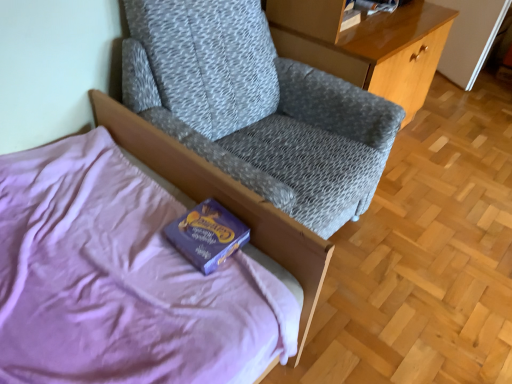
The height and width of the screenshot is (384, 512). I want to click on textured gray fabric chair at upper center, so pyautogui.click(x=257, y=108).

What do you see at coordinates (224, 201) in the screenshot? This screenshot has width=512, height=384. I see `purple soft bed at lower left` at bounding box center [224, 201].

Measure the distance between point (168,168) and camera.

Point (168,168) is 4.24 feet from camera.

What are the coordinates of `textured gray fabric chair at upper center` in the screenshot? It's located at (257, 108).

Can you tell me how much textured gray fabric chair at upper center and wooden glossy desk at upper right differ in facing direction?

2.06 degrees.

Looking at their sizes, would you say textured gray fabric chair at upper center is wider or thinner than wooden glossy desk at upper right?

In the image, textured gray fabric chair at upper center appears to be wider than wooden glossy desk at upper right.

Would you consider textured gray fabric chair at upper center to be distant from wooden glossy desk at upper right?

No.

Based on their sizes in the image, would you say textured gray fabric chair at upper center is bigger or smaller than wooden glossy desk at upper right?

In the image, textured gray fabric chair at upper center appears to be larger than wooden glossy desk at upper right.

Can you confirm if textured gray fabric chair at upper center is positioned to the left of purple soft bed at lower left?

Yes.

Which of these two, textured gray fabric chair at upper center or purple soft bed at lower left, is thinner?

With smaller width is textured gray fabric chair at upper center.

Which object is more forward, textured gray fabric chair at upper center or purple soft bed at lower left?

Positioned in front is purple soft bed at lower left.

Is textured gray fabric chair at upper center aimed at purple soft bed at lower left?

No, textured gray fabric chair at upper center is not oriented towards purple soft bed at lower left.

Considering the relative sizes of wooden glossy desk at upper right and purple soft bed at lower left in the image provided, is wooden glossy desk at upper right bigger than purple soft bed at lower left?

Yes.

From the picture: Measure the distance from wooden glossy desk at upper right to purple soft bed at lower left.

wooden glossy desk at upper right and purple soft bed at lower left are 1.04 meters apart.

Is wooden glossy desk at upper right not within purple soft bed at lower left?

That's correct, wooden glossy desk at upper right is outside of purple soft bed at lower left.

How far apart are purple matte paperback book at lower left and wooden glossy desk at upper right?

The distance of purple matte paperback book at lower left from wooden glossy desk at upper right is 1.13 meters.

Considering the sizes of purple matte paperback book at lower left and wooden glossy desk at upper right in the image, is purple matte paperback book at lower left bigger or smaller than wooden glossy desk at upper right?

In the image, purple matte paperback book at lower left appears to be smaller than wooden glossy desk at upper right.

Which of these two, purple matte paperback book at lower left or wooden glossy desk at upper right, stands shorter?

With less height is purple matte paperback book at lower left.

How many degrees apart are the facing directions of purple soft bed at lower left and purple matte paperback book at lower left?

The facing directions of purple soft bed at lower left and purple matte paperback book at lower left are 179 degrees apart.

Does purple soft bed at lower left touch purple matte paperback book at lower left?

They are not placed beside each other.

From the image's perspective, would you say purple soft bed at lower left is positioned over purple matte paperback book at lower left?

Yes, from the image's perspective, purple soft bed at lower left is above purple matte paperback book at lower left.

Where is `paperback book behind the purple soft bed at lower left`? The height and width of the screenshot is (384, 512). paperback book behind the purple soft bed at lower left is located at coordinates (207, 235).

In the scene shown: Measure the distance from wooden glossy desk at upper right to textured gray fabric chair at upper center.

wooden glossy desk at upper right is 16.84 inches from textured gray fabric chair at upper center.

Considering the points (394, 81) and (335, 120), which point is behind, point (394, 81) or point (335, 120)?

The point (394, 81) is more distant.

Between wooden glossy desk at upper right and textured gray fabric chair at upper center, which one has smaller size?

With smaller size is wooden glossy desk at upper right.

In the image, is wooden glossy desk at upper right positioned in front of or behind purple matte paperback book at lower left?

wooden glossy desk at upper right is positioned farther from the viewer than purple matte paperback book at lower left.

Measure the distance between wooden glossy desk at upper right and purple matte paperback book at lower left.

A distance of 3.69 feet exists between wooden glossy desk at upper right and purple matte paperback book at lower left.

From a real-world perspective, which object stands above the other?

wooden glossy desk at upper right, from a real-world perspective.

Could you tell me if wooden glossy desk at upper right is facing purple matte paperback book at lower left?

No, wooden glossy desk at upper right is not oriented towards purple matte paperback book at lower left.

Locate an element on the screen. chair in front of the wooden glossy desk at upper right is located at coordinates (257, 108).

The height and width of the screenshot is (384, 512). In order to click on chair behind the purple soft bed at lower left in this screenshot , I will do `click(257, 108)`.

Considering their positions, is textured gray fabric chair at upper center positioned further to purple soft bed at lower left than wooden glossy desk at upper right?

The object further to purple soft bed at lower left is wooden glossy desk at upper right.

Which object lies nearer to the anchor point textured gray fabric chair at upper center, purple matte paperback book at lower left or purple soft bed at lower left?

purple soft bed at lower left is closer to textured gray fabric chair at upper center.

Looking at the image, which one is located further to purple soft bed at lower left, textured gray fabric chair at upper center or purple matte paperback book at lower left?

textured gray fabric chair at upper center is positioned further to the anchor purple soft bed at lower left.

Estimate the real-world distances between objects in this image. Which object is further from wooden glossy desk at upper right, purple soft bed at lower left or textured gray fabric chair at upper center?

purple soft bed at lower left.

Looking at the image, which one is located further to wooden glossy desk at upper right, textured gray fabric chair at upper center or purple matte paperback book at lower left?

purple matte paperback book at lower left lies further to wooden glossy desk at upper right than the other object.

From the image, which object appears to be nearer to wooden glossy desk at upper right, purple soft bed at lower left or purple matte paperback book at lower left?

The object closer to wooden glossy desk at upper right is purple soft bed at lower left.

Based on their spatial positions, is purple matte paperback book at lower left or textured gray fabric chair at upper center further from wooden glossy desk at upper right?

purple matte paperback book at lower left lies further to wooden glossy desk at upper right than the other object.

From the image, which object appears to be farther from purple soft bed at lower left, purple matte paperback book at lower left or wooden glossy desk at upper right?

Among the two, wooden glossy desk at upper right is located further to purple soft bed at lower left.

This screenshot has width=512, height=384. Find the location of `chair that lies between wooden glossy desk at upper right and purple matte paperback book at lower left from top to bottom`. chair that lies between wooden glossy desk at upper right and purple matte paperback book at lower left from top to bottom is located at coordinates (257, 108).

Where is `desk located between purple matte paperback book at lower left and purple soft bed at lower left in the left-right direction`? The width and height of the screenshot is (512, 384). desk located between purple matte paperback book at lower left and purple soft bed at lower left in the left-right direction is located at coordinates (366, 45).

I want to click on desk situated between textured gray fabric chair at upper center and purple soft bed at lower left from left to right, so click(366, 45).

Where is `chair located between purple matte paperback book at lower left and purple soft bed at lower left in the left-right direction`? This screenshot has height=384, width=512. chair located between purple matte paperback book at lower left and purple soft bed at lower left in the left-right direction is located at coordinates (257, 108).